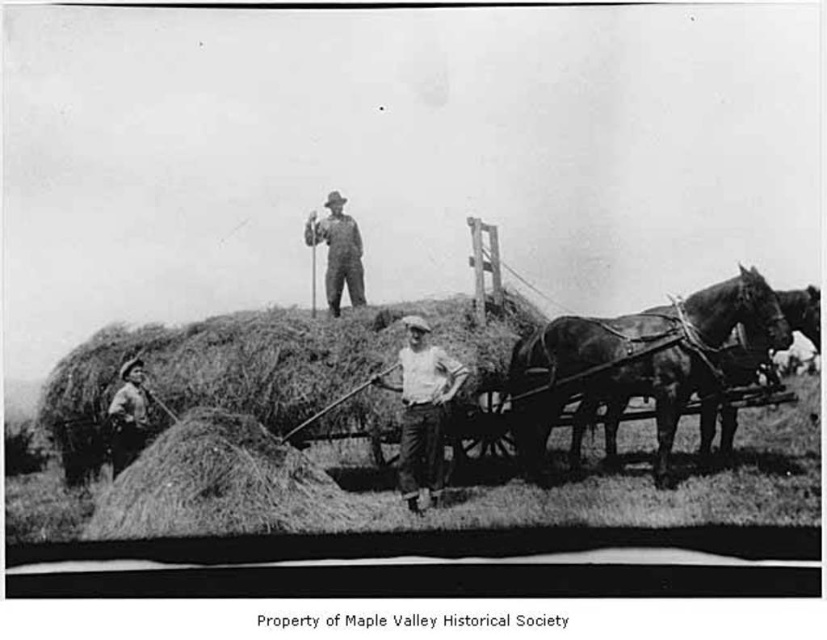
You are a farmer standing at the edge of the hay pile. You need to move a bale of hay from the dark brown glossy horse at right to the center of the hay pile. The bale weighs 50 kg. Your strength allows you to carry up to 40 kg. Can you move the bale yourself, or do you need help?

The bale weighs 50 kg, which exceeds your carrying capacity of 40 kg. You need help to move the bale from the dark brown glossy horse at right to the center of the hay pile.

Based on the photo, you are a farmer who needs to move the rugged brown leather jacket at lower left to the other side of the dark brown glossy horse at right. Is the horse in the way of moving the jacket?

The dark brown glossy horse at right is bigger than the rugged brown leather jacket at lower left, so the horse is likely blocking the path, making it difficult to move the jacket without moving the horse first.

You are a farmer standing near the dark brown glossy horse at right. You need to hand a tool to the white cotton shirt at center. Can you reach them directly without moving from your current position?

The dark brown glossy horse at right is closer to the viewer than the white cotton shirt at center, so you cannot reach them directly without moving because the horse is between you and the shirt.